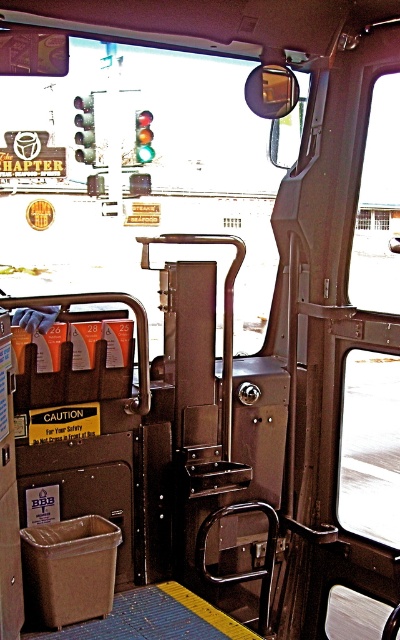
Does green glass traffic light at upper center have a smaller size compared to glassy red traffic light at upper center?

No.

Is point (94, 154) positioned in front of point (148, 120)?

Yes, point (94, 154) is closer to viewer.

Between point (84, 116) and point (151, 154), which one is positioned in front?

Point (84, 116) is in front.

The width and height of the screenshot is (400, 640). Find the location of `green glass traffic light at upper center`. green glass traffic light at upper center is located at coordinates (84, 129).